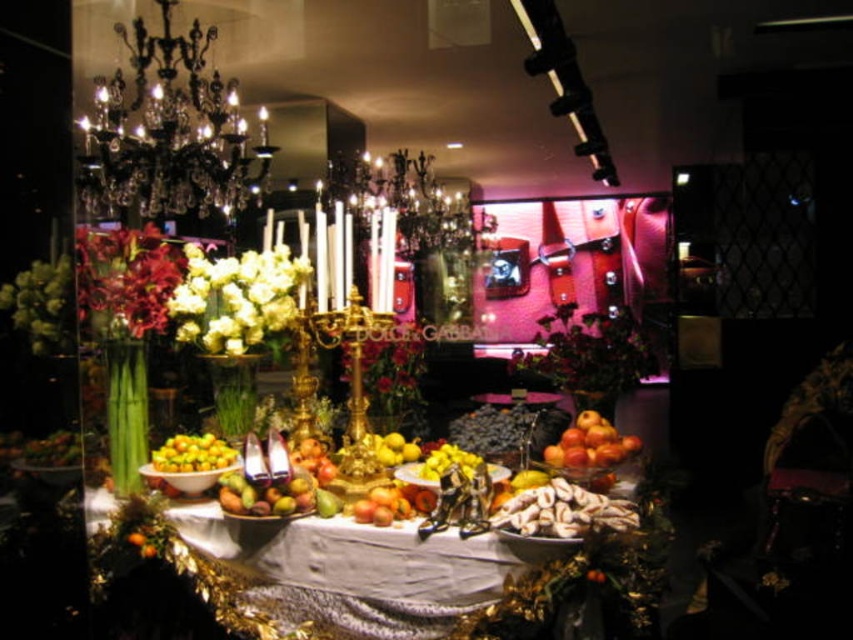
You are a florist arranging a bouquet for a client. You have the white matte flowers at center and the shiny red petals at left. Which of these two items is positioned lower on the table?

The white matte flowers at center are positioned lower than the shiny red petals at left.

You are an interior designer assessing the spatial arrangement of the display. Given the black crystal chandelier at upper left and the shiny red petals at left, which object occupies a larger horizontal space in the scene?

The black crystal chandelier at upper left has a greater width than the shiny red petals at left, so it occupies a larger horizontal space in the scene.